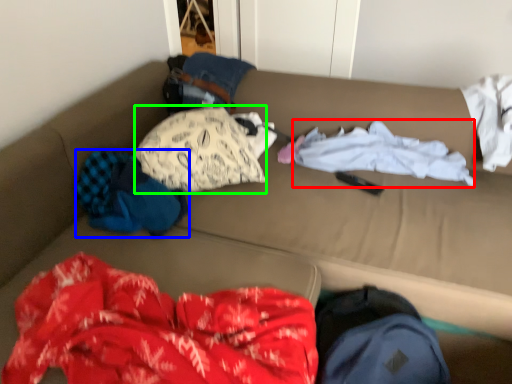
Question: Which is nearer to the clothing (highlighted by a red box)? clothing (highlighted by a blue box) or clothing (highlighted by a green box).

Choices:
 (A) clothing
 (B) clothing

Answer: (B)